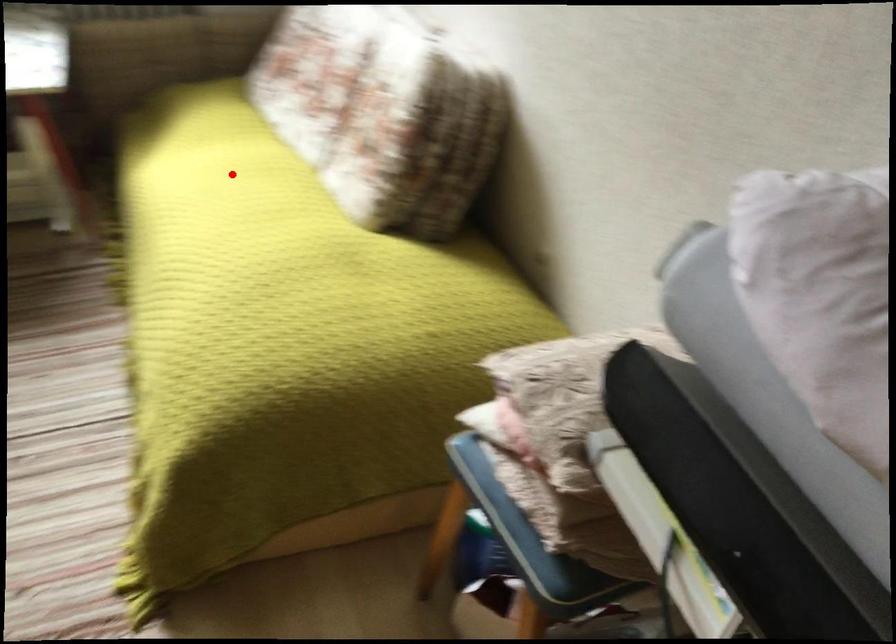
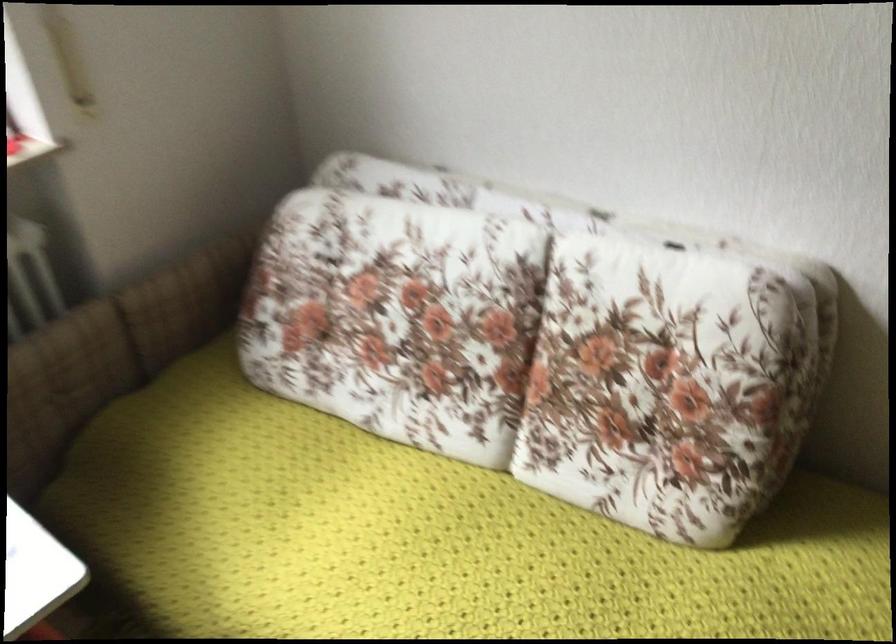
Find the pixel in the second image that matches the highlighted location in the first image.

(429, 538)